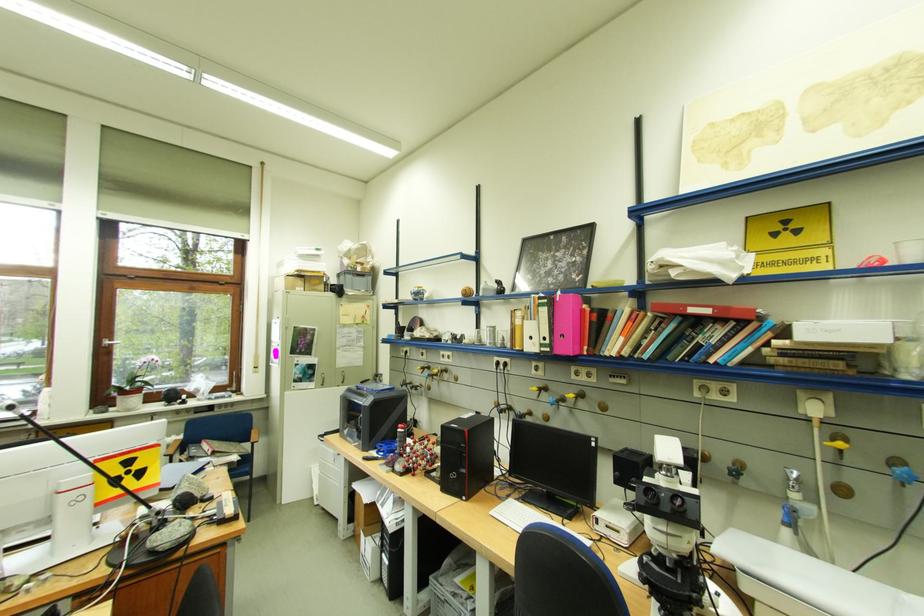
What do you see at coordinates (736, 471) in the screenshot? I see `the black valve handle` at bounding box center [736, 471].